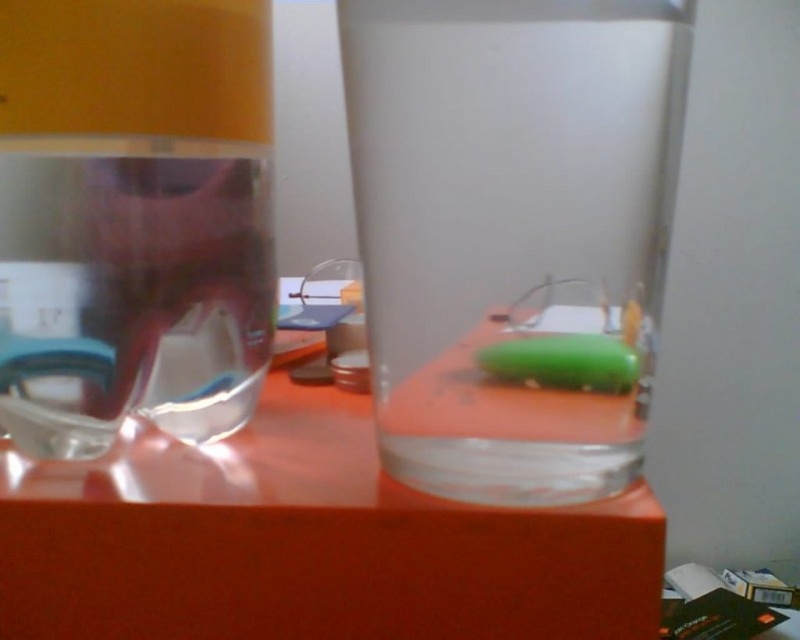
Question: Which object appears farthest from the camera in this image?

Choices:
 (A) orange glossy table at center
 (B) transparent plastic bottle at left

Answer: (B)

Question: Can you confirm if orange glossy table at center is positioned below transparent plastic bottle at left?

Choices:
 (A) yes
 (B) no

Answer: (A)

Question: Does orange glossy table at center appear under transparent plastic bottle at left?

Choices:
 (A) no
 (B) yes

Answer: (B)

Question: Is orange glossy table at center to the right of transparent plastic bottle at left from the viewer's perspective?

Choices:
 (A) yes
 (B) no

Answer: (A)

Question: Among these objects, which one is farthest from the camera?

Choices:
 (A) orange glossy table at center
 (B) transparent plastic bottle at left

Answer: (B)